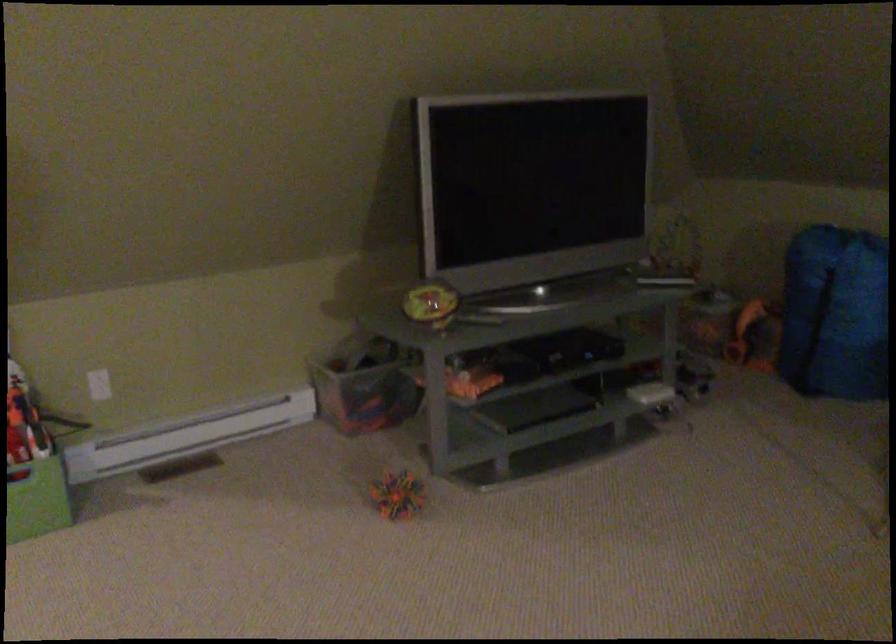
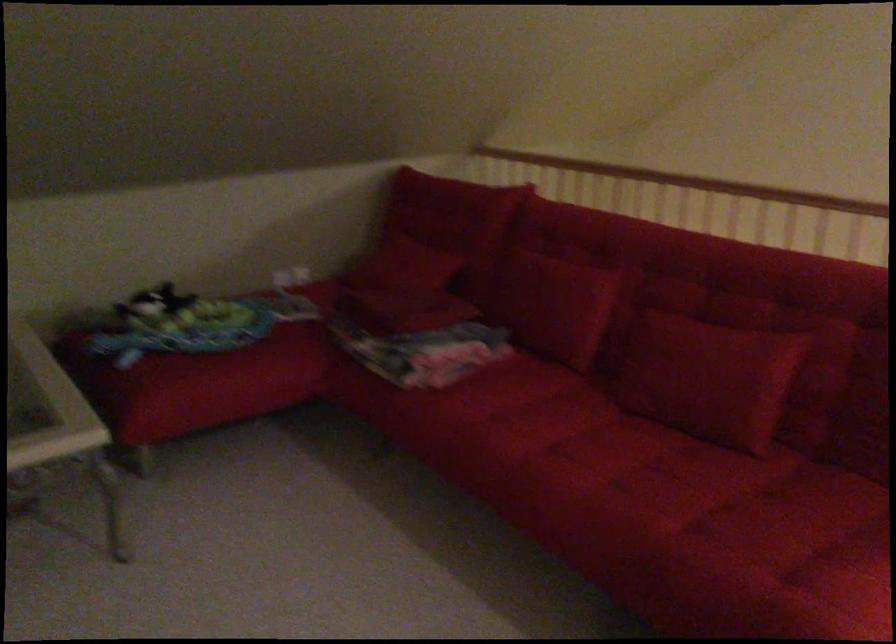
The images are taken continuously from a first-person perspective. In which direction is your viewpoint rotating?

The camera rotated toward right-down.